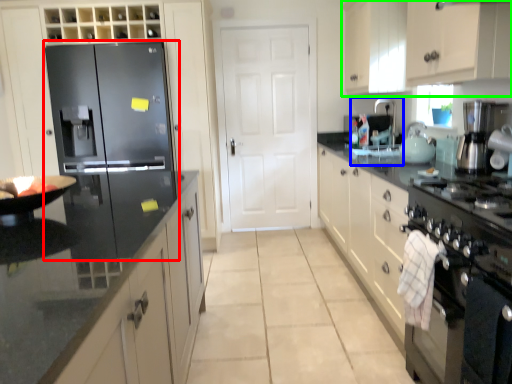
Question: Which object is the closest to the refrigerator (highlighted by a red box)? Choose among these: sink (highlighted by a blue box) or cabinetry (highlighted by a green box).

Choices:
 (A) sink
 (B) cabinetry

Answer: (A)